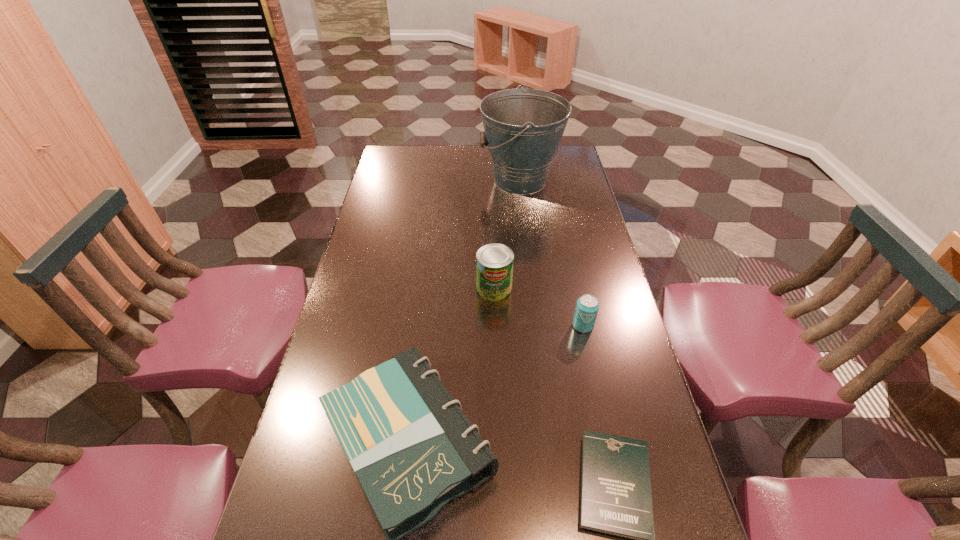
The height and width of the screenshot is (540, 960). Identify the location of the farthest object. (523, 128).

The image size is (960, 540). Find the location of `bucket`. bucket is located at coordinates (523, 128).

Where is `the fourth shortest object`? The height and width of the screenshot is (540, 960). the fourth shortest object is located at coordinates (494, 262).

The image size is (960, 540). I want to click on the fourth nearest object, so click(494, 262).

The width and height of the screenshot is (960, 540). Find the location of `beer can`. beer can is located at coordinates (587, 306).

Where is `vacant region located 0.180m with the handle on opposite sides of the bucket`? vacant region located 0.180m with the handle on opposite sides of the bucket is located at coordinates (436, 181).

This screenshot has width=960, height=540. I want to click on vacant area located 0.130m with the handle on opposite sides of the bucket, so click(447, 181).

What are the coordinates of `free point located 0.240m with the handle on opposite sides of the bucket` in the screenshot? It's located at (420, 181).

Where is `vacant space located on the left of the can`? vacant space located on the left of the can is located at coordinates (350, 288).

Locate an element on the screen. This screenshot has width=960, height=540. vacant area located 0.120m on the front of the third farthest object is located at coordinates (592, 370).